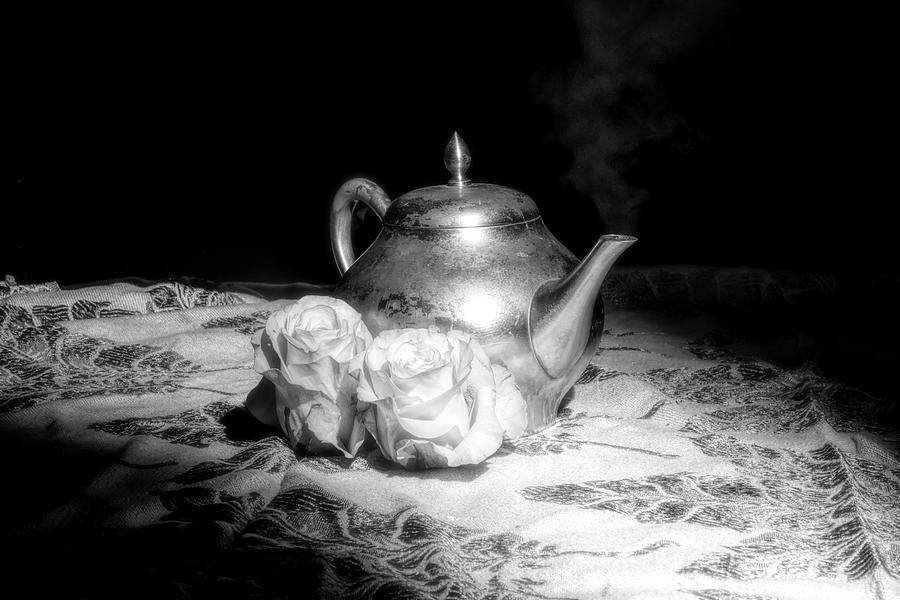
Where is `blanket`? The width and height of the screenshot is (900, 600). blanket is located at coordinates (464, 508).